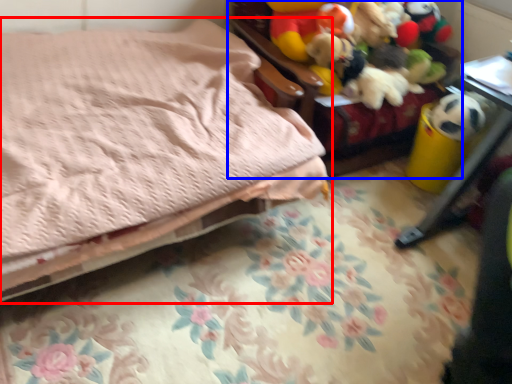
Question: Which object appears closest to the camera in this image, bed (highlighted by a red box) or furniture (highlighted by a blue box)?

Choices:
 (A) bed
 (B) furniture

Answer: (A)